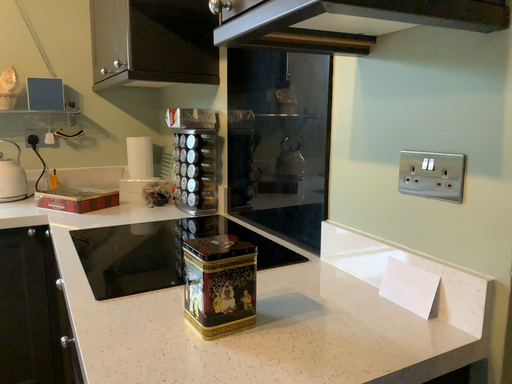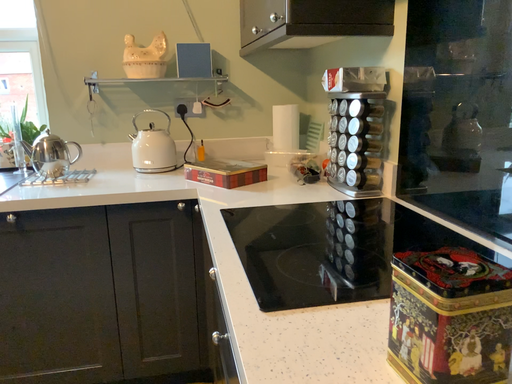
Question: Which way did the camera rotate in the video?

Choices:
 (A) rotated left
 (B) rotated right

Answer: (A)